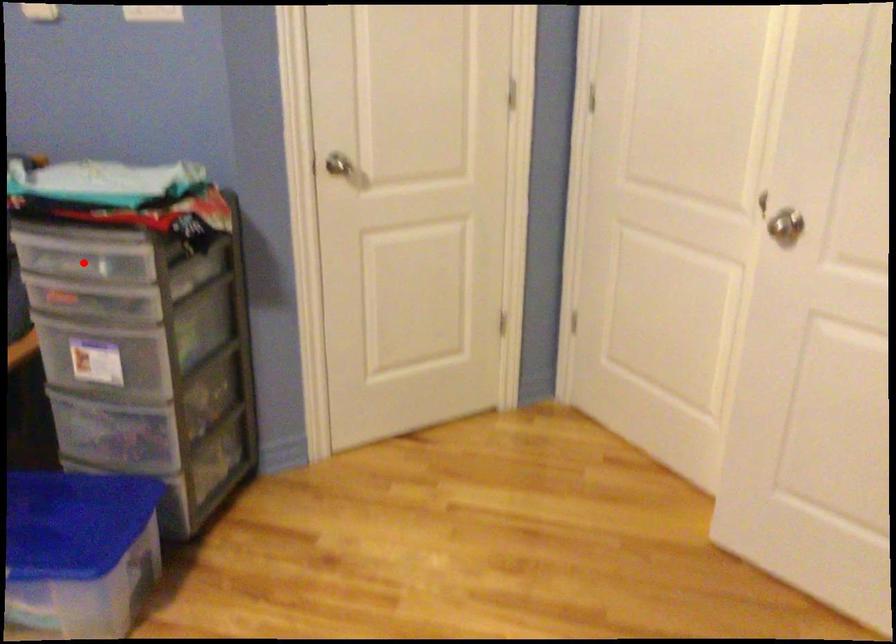
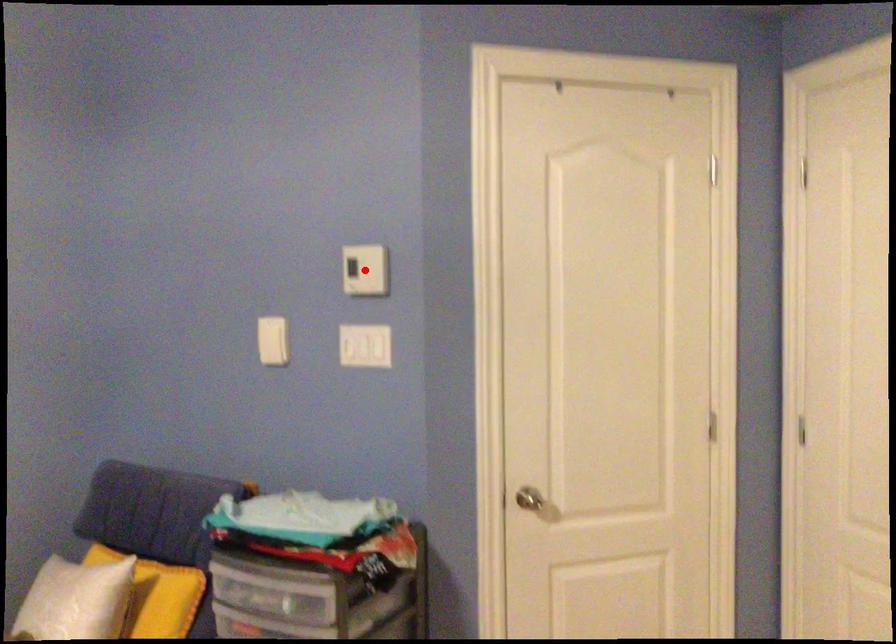
I am providing you with two images of the same scene from different viewpoints. A red point is marked on the first image and another point is marked on the second image. Does the point marked in image1 correspond to the same location as the one in image2?

No